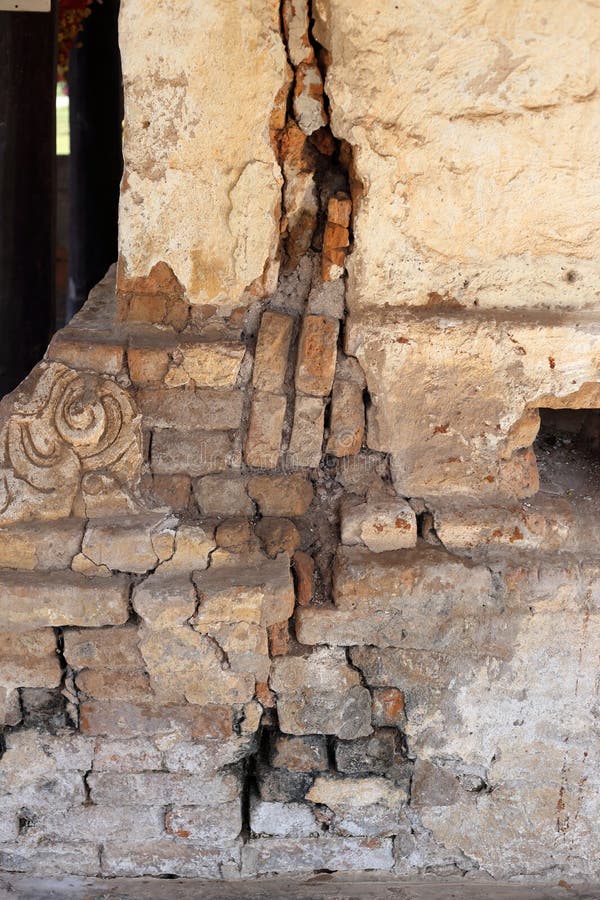
Find the location of `sunlight on wall`. sunlight on wall is located at coordinates (218, 148).